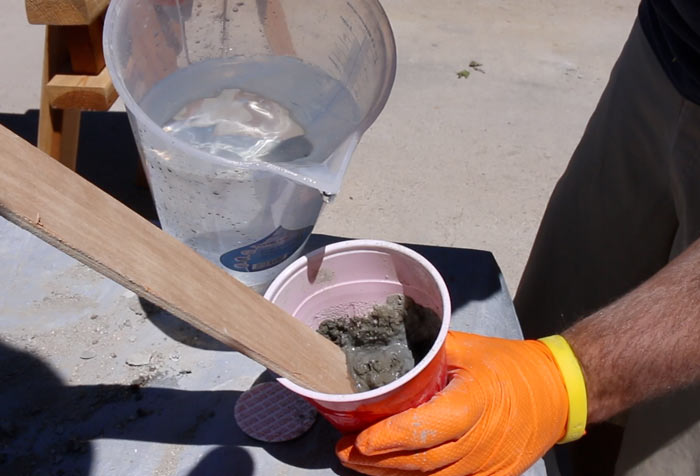
At what (x,y) coordinates should I click in order to perform the action: click on white cups. Please return your answer as a coordinate pair (x, y). This screenshot has height=476, width=700. Looking at the image, I should click on (337, 273).